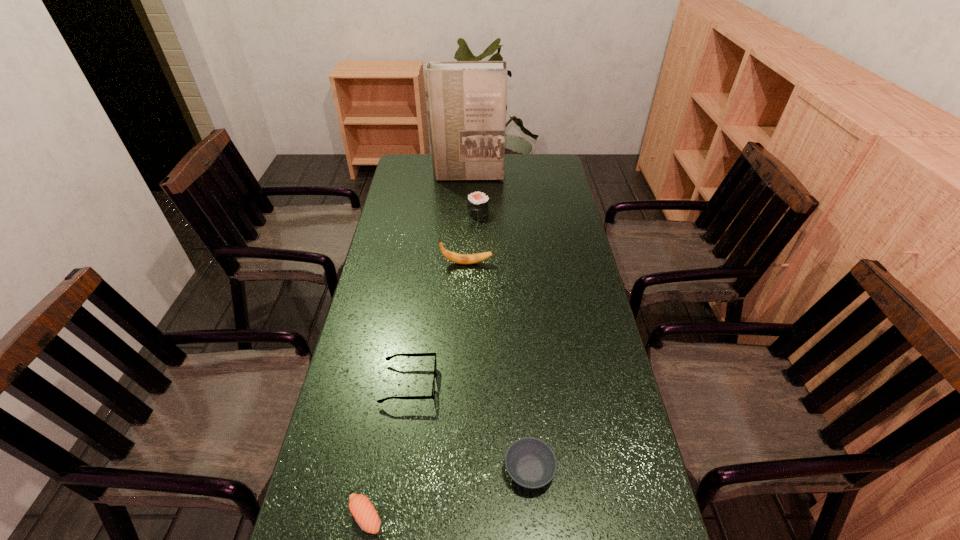
Identify the location of object at the far left corner. (466, 100).

Find the location of a particular element. vacant space at the left edge of the desktop is located at coordinates pyautogui.click(x=331, y=512).

In the image, there is a desktop. In order to click on vacant space at the right edge in this screenshot , I will do `click(565, 208)`.

Identify the location of free space at the far left corner of the desktop. This screenshot has width=960, height=540. (404, 158).

At what (x,y) coordinates should I click in order to perform the action: click on free space that is in between the banana and the farthest object. Please return your answer as a coordinate pair (x, y). Looking at the image, I should click on pos(468,219).

Locate an element on the screen. This screenshot has height=540, width=960. free space that is in between the farthest object and the second tallest object is located at coordinates (468, 219).

This screenshot has width=960, height=540. Find the location of `unoccupied position between the nearest object and the fifth nearest object`. unoccupied position between the nearest object and the fifth nearest object is located at coordinates [421, 364].

The image size is (960, 540). I want to click on vacant area that lies between the second nearest object and the taller sushi, so tap(504, 341).

Image resolution: width=960 pixels, height=540 pixels. What are the coordinates of `empty location between the phonebook and the fourth nearest object` in the screenshot? It's located at (468, 219).

In order to click on unoccupied area between the soup bowl and the nearer sushi in this screenshot , I will do pyautogui.click(x=447, y=493).